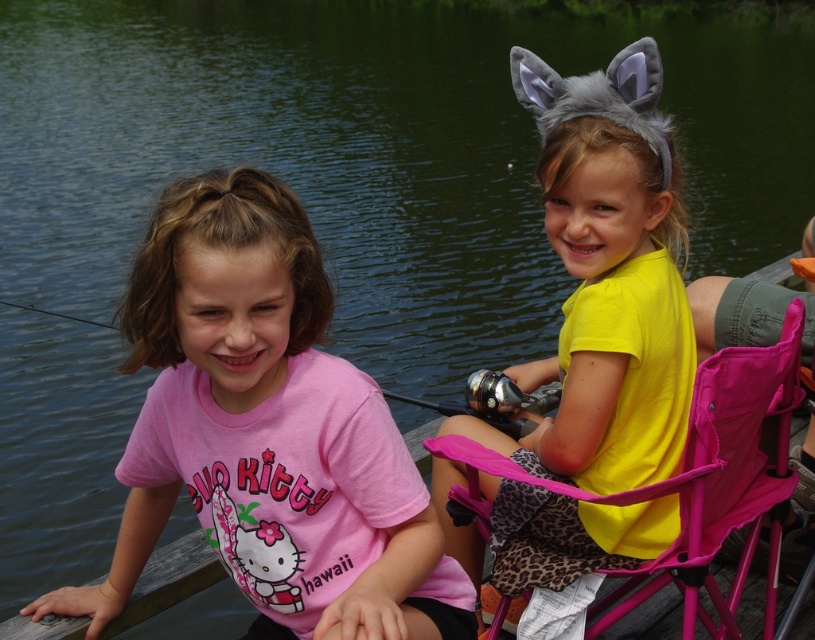
Please look at the image. There is a point marked at coordinates (606, 276). Which object from the list below is located exactly at that point? The options are the girl with the pink Hello Kitty Tshirt on the left, the girl with the yellow matte shirt at center, or the girl with the leopard print skirt on the right.

The point at coordinates (606, 276) marks the yellow matte shirt at center.

You are a photographer trying to capture both the pink matte shirt at left and the yellow matte shirt at center in a single frame. Since the shirts are at different heights, which one should you focus on first to ensure both are in focus?

The pink matte shirt at left is shorter than the yellow matte shirt at center, so you should focus on the yellow matte shirt at center first to ensure both are in focus.

You are a photographer trying to capture a photo of the two girls on the dock. You want to ensure both the yellow matte shirt at center and the pink fabric chair at right are clearly visible. Based on their positions, which object should you focus on first to ensure both are in frame?

The yellow matte shirt at center is to the left of the pink fabric chair at right. To ensure both are in frame, focus on the yellow matte shirt at center first as it is positioned to the left, allowing the camera to capture the entire area from left to right, including both objects.